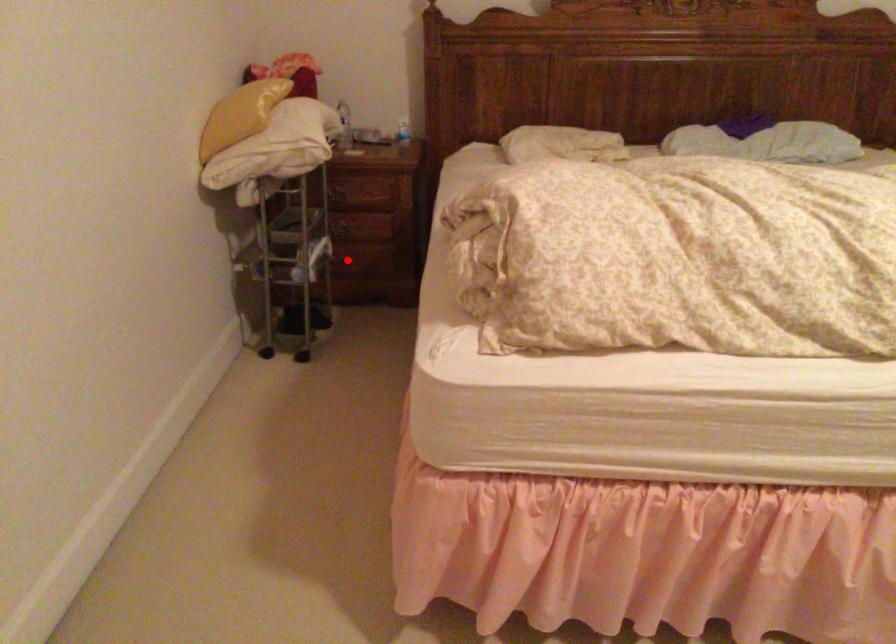
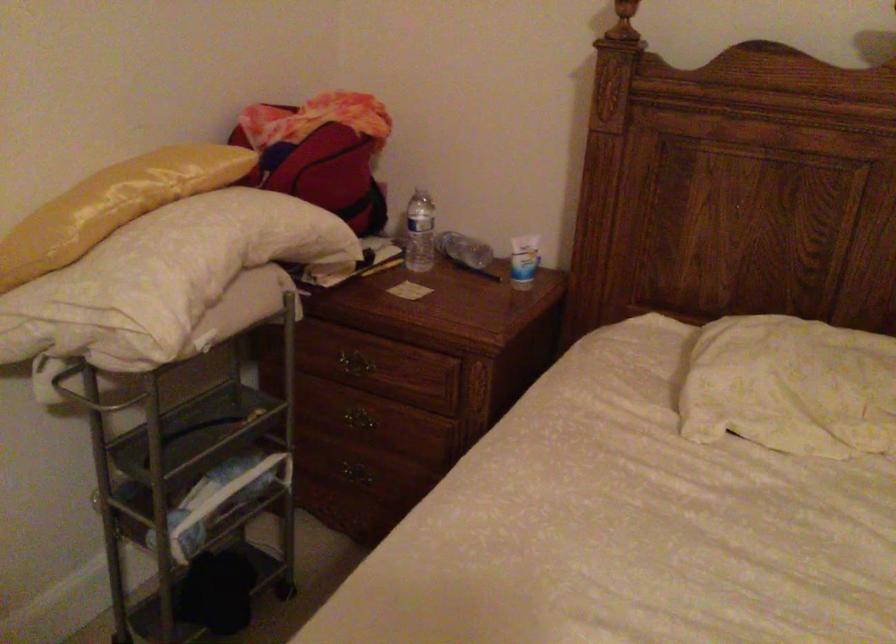
Where in the second image is the point corresponding to the highlighted location from the first image?

(355, 473)